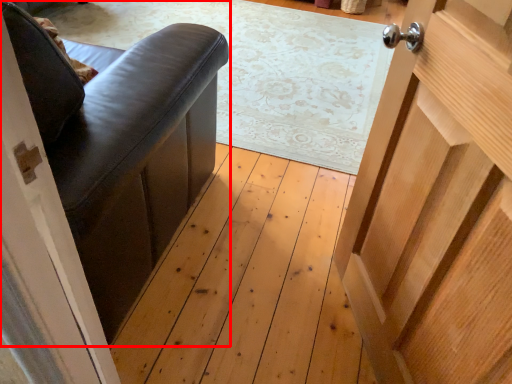
Question: In this image, where is furniture (annotated by the red box) located relative to door?

Choices:
 (A) right
 (B) left

Answer: (B)